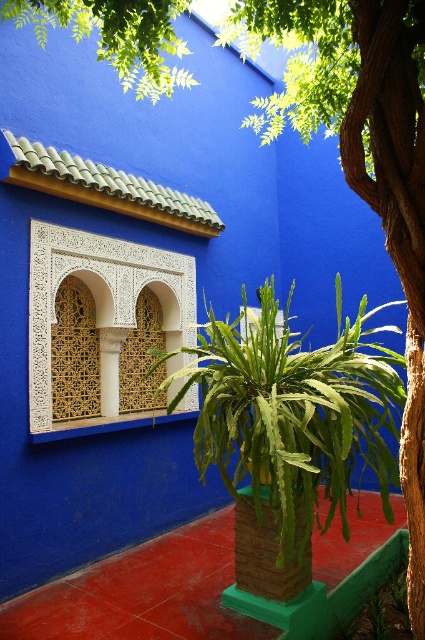
Which is below, green leafy fern at center or brick textured pillar at center?

brick textured pillar at center is below.

Which is more to the left, green leafy fern at center or brick textured pillar at center?

From the viewer's perspective, brick textured pillar at center appears more on the left side.

Is point (348, 330) in front of point (235, 577)?

No, it is behind (235, 577).

You are a GUI agent. You are given a task and a screenshot of the screen. Output one action in this format:
    pyautogui.click(x=<x>, y=<y>)
    Task: Click on the green leafy fern at center
    The height and width of the screenshot is (640, 425).
    Given the screenshot: What is the action you would take?
    pyautogui.click(x=295, y=410)

Between green leafy fern at center and white carved wood at center, which one has more height?

green leafy fern at center

Does green leafy fern at center appear on the left side of white carved wood at center?

No, green leafy fern at center is not to the left of white carved wood at center.

You are a GUI agent. You are given a task and a screenshot of the screen. Output one action in this format:
    pyautogui.click(x=<x>, y=<y>)
    Task: Click on the green leafy fern at center
    Image resolution: width=425 pixels, height=640 pixels.
    Given the screenshot: What is the action you would take?
    pyautogui.click(x=295, y=410)

Where is `green leafy fern at center`? green leafy fern at center is located at coordinates click(295, 410).

Who is positioned more to the right, brick textured pillar at center or white carved wood at center?

Positioned to the right is brick textured pillar at center.

This screenshot has height=640, width=425. What do you see at coordinates (272, 570) in the screenshot?
I see `brick textured pillar at center` at bounding box center [272, 570].

Locate an element on the screen. The width and height of the screenshot is (425, 640). brick textured pillar at center is located at coordinates (272, 570).